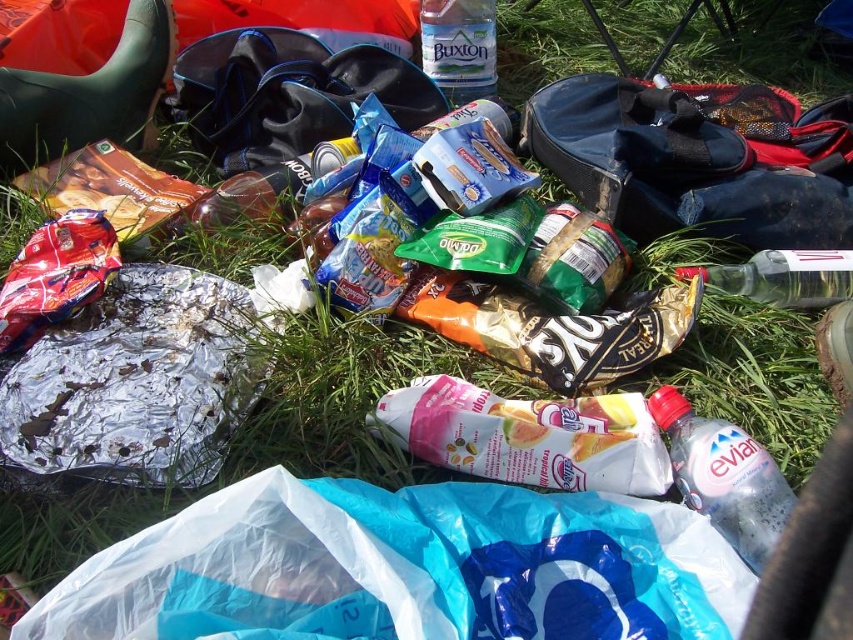
Question: Which is farther from the white matte snack packet at center?

Choices:
 (A) clear plastic bottle at lower right
 (B) clear plastic bottle at center

Answer: (B)

Question: Among these objects, which one is nearest to the camera?

Choices:
 (A) blue plastic bag at lower center
 (B) clear plastic bottle at center-right
 (C) clear plastic bottle at center
 (D) white matte snack packet at center

Answer: (A)

Question: Is blue plastic bag at lower center in front of clear plastic bottle at lower right?

Choices:
 (A) yes
 (B) no

Answer: (A)

Question: Among these objects, which one is nearest to the camera?

Choices:
 (A) clear plastic bottle at lower right
 (B) clear plastic bottle at center
 (C) white matte snack packet at center
 (D) blue plastic bag at lower center

Answer: (D)

Question: Is blue plastic bag at lower center in front of white matte snack packet at center?

Choices:
 (A) no
 (B) yes

Answer: (B)

Question: Does clear plastic bottle at lower right appear on the right side of clear plastic bottle at center?

Choices:
 (A) yes
 (B) no

Answer: (A)